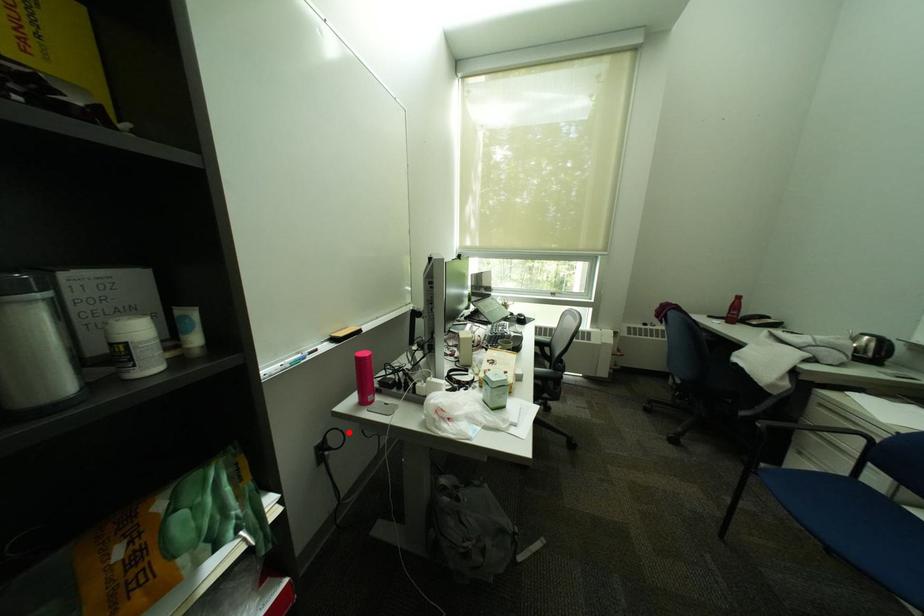
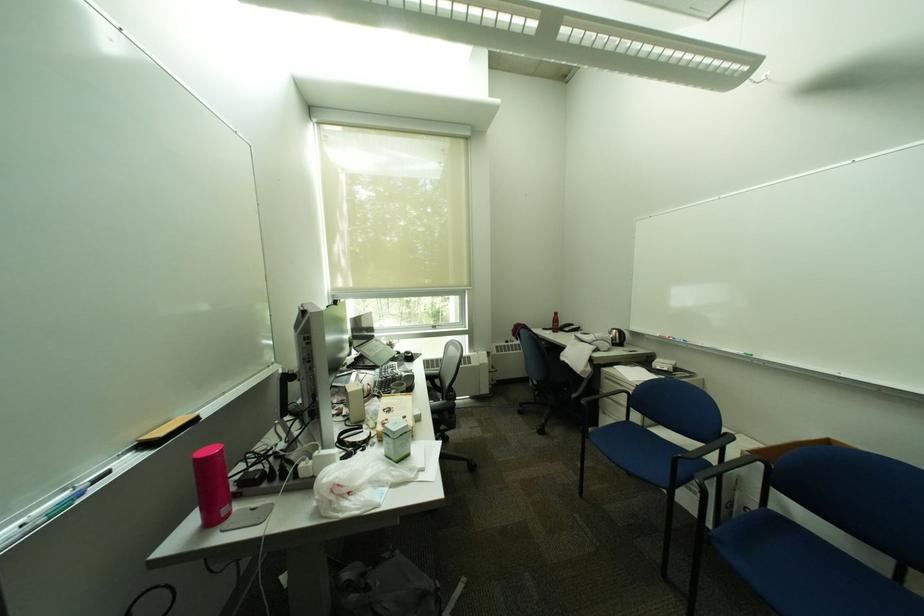
Question: I am providing you with two images of the same scene from different viewpoints. A red point is shown in image1. For the corresponding object point in image2, is it positioned nearer or farther from the camera?

Choices:
 (A) Nearer
 (B) Farther

Answer: (A)